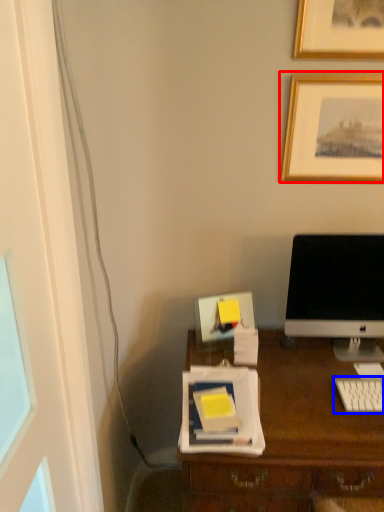
Question: Which of the following is the closest to the observer, picture frame (highlighted by a red box) or computer keyboard (highlighted by a blue box)?

Choices:
 (A) picture frame
 (B) computer keyboard

Answer: (B)